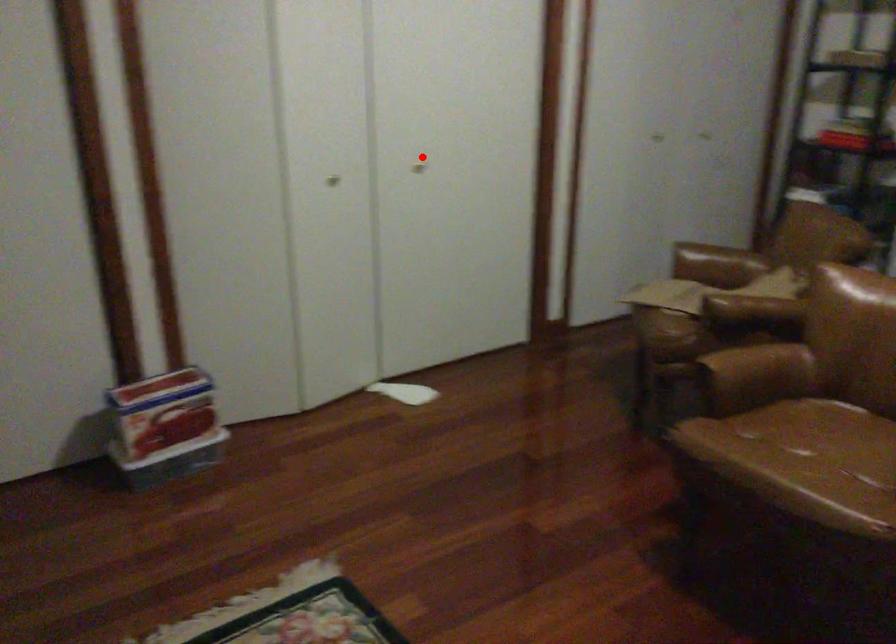
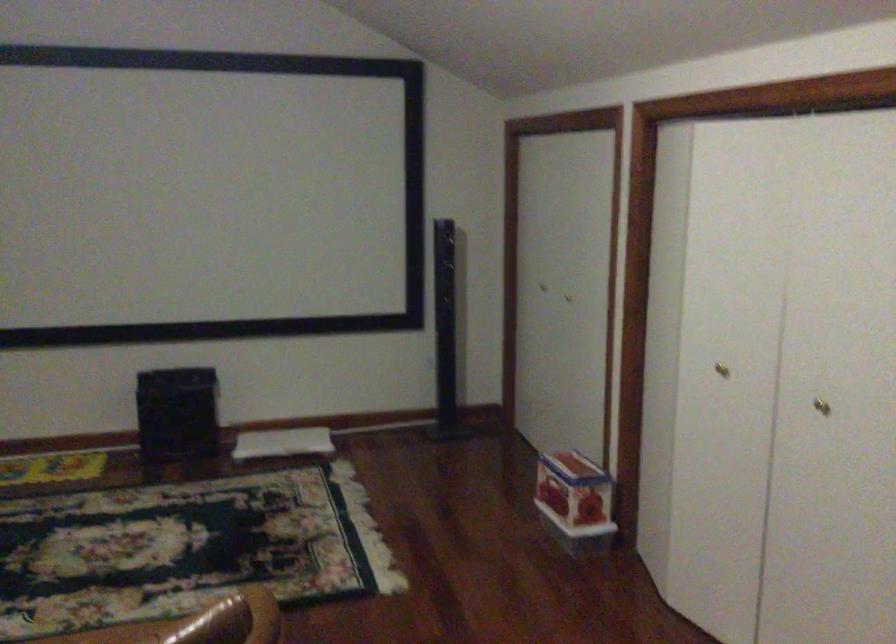
Where in the second image is the point corresponding to the highlighted location from the first image?

(821, 406)